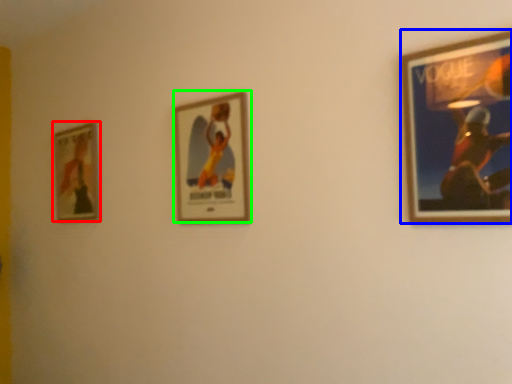
Question: Estimate the real-world distances between objects in this image. Which object is closer to picture frame (highlighted by a red box), picture frame (highlighted by a blue box) or picture frame (highlighted by a green box)?

Choices:
 (A) picture frame
 (B) picture frame

Answer: (B)